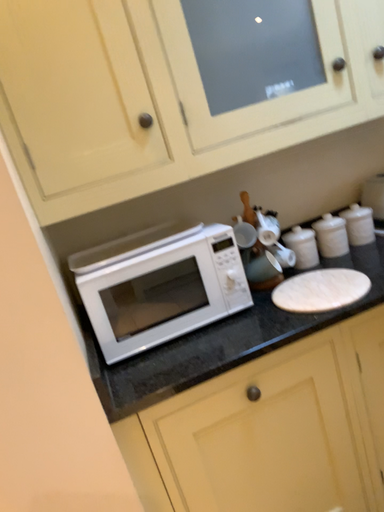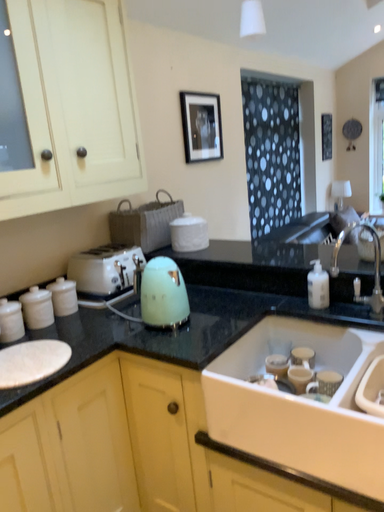
Question: Which way did the camera rotate in the video?

Choices:
 (A) rotated left
 (B) rotated right

Answer: (B)